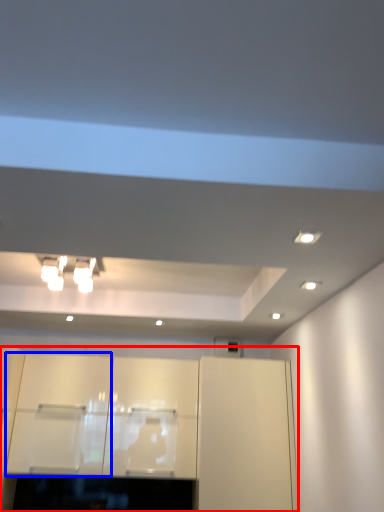
Question: Which object appears farthest to the camera in this image, cabinetry (highlighted by a red box) or cabinetry (highlighted by a blue box)?

Choices:
 (A) cabinetry
 (B) cabinetry

Answer: (B)